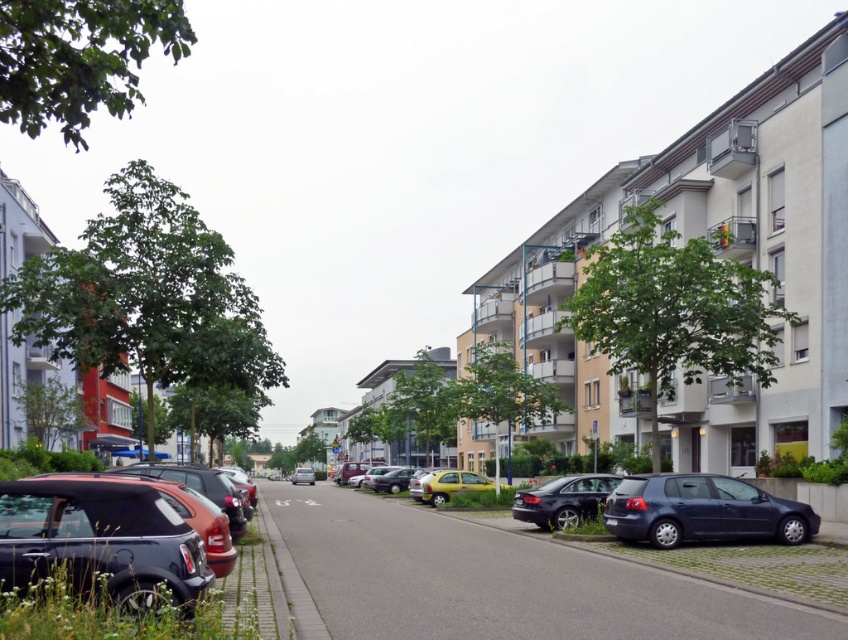
Question: Where is dark blue metallic hatchback at lower right located in relation to shiny black sedan at center in the image?

Choices:
 (A) above
 (B) below

Answer: (A)

Question: Can you confirm if shiny black car at lower left is bigger than dark blue metallic hatchback at lower right?

Choices:
 (A) yes
 (B) no

Answer: (A)

Question: Which point is closer to the camera?

Choices:
 (A) dark blue metallic hatchback at lower right
 (B) shiny black sedan at center
 (C) silver metallic car at center
 (D) yellow matte car at center

Answer: (A)

Question: Which is farther from the shiny black car at lower left?

Choices:
 (A) silver metallic car at center
 (B) shiny black sedan at center
 (C) yellow matte car at center
 (D) dark blue metallic hatchback at lower right

Answer: (A)

Question: Is shiny black car at lower left closer to the viewer compared to shiny black sedan at center?

Choices:
 (A) yes
 (B) no

Answer: (A)

Question: Among these objects, which one is farthest from the camera?

Choices:
 (A) dark blue metallic hatchback at lower right
 (B) shiny black sedan at center

Answer: (B)